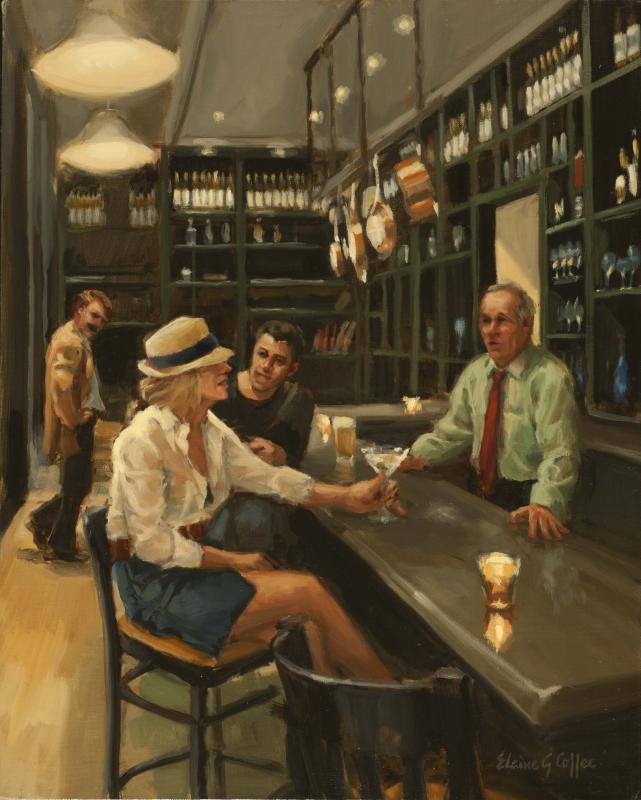
The width and height of the screenshot is (641, 800). What are the coordinates of `bar chair` in the screenshot? It's located at (197, 658), (362, 712).